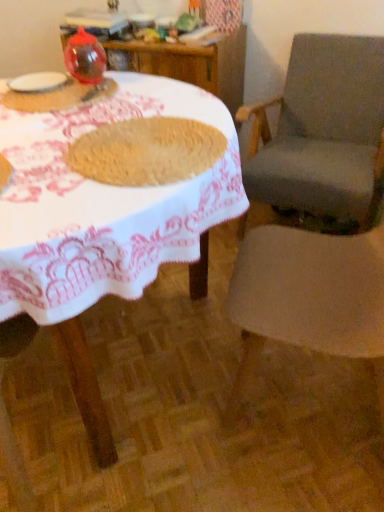
Question: Considering the positions of point (69, 52) and point (357, 174), is point (69, 52) closer or farther from the camera than point (357, 174)?

Choices:
 (A) closer
 (B) farther

Answer: (A)

Question: Which is correct: transparent plastic balloon at upper left, placed as the third tableware when sorted from bottom to top, is inside gray fabric chair at right, marked as the first chair in a back-to-front arrangement, or outside of it?

Choices:
 (A) outside
 (B) inside

Answer: (A)

Question: Which object is positioned closest to the transparent plastic balloon at upper left, placed as the third tableware when sorted from bottom to top?

Choices:
 (A) white woven table at center
 (B) gray fabric chair at right, marked as the first chair in a back-to-front arrangement
 (C) translucent plastic cup at upper left, which appears as the first tableware when ordered from the bottom
 (D) white matte plate at upper left, marked as the 2th tableware in a bottom-to-top arrangement
 (E) brown woven mat at center

Answer: (D)

Question: Based on their relative distances, which object is farther from the brown woven mat at center?

Choices:
 (A) transparent plastic balloon at upper left, placed as the third tableware when sorted from bottom to top
 (B) gray fabric chair at right, which ranks as the 2th chair in front-to-back order
 (C) white woven table at center
 (D) translucent plastic cup at upper left, which appears as the first tableware when ordered from the bottom
 (E) white matte plate at upper left, marked as the 2th tableware in a bottom-to-top arrangement

Answer: (B)